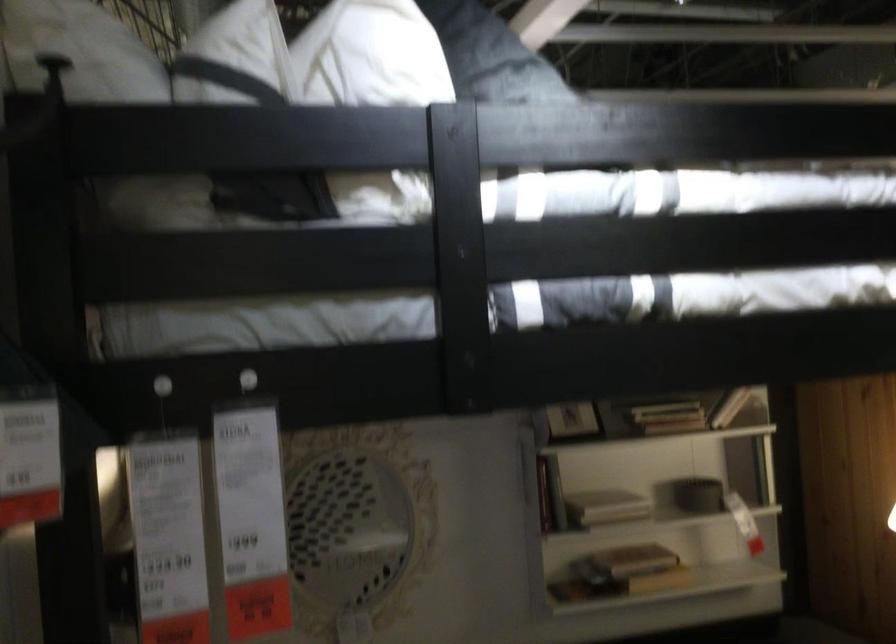
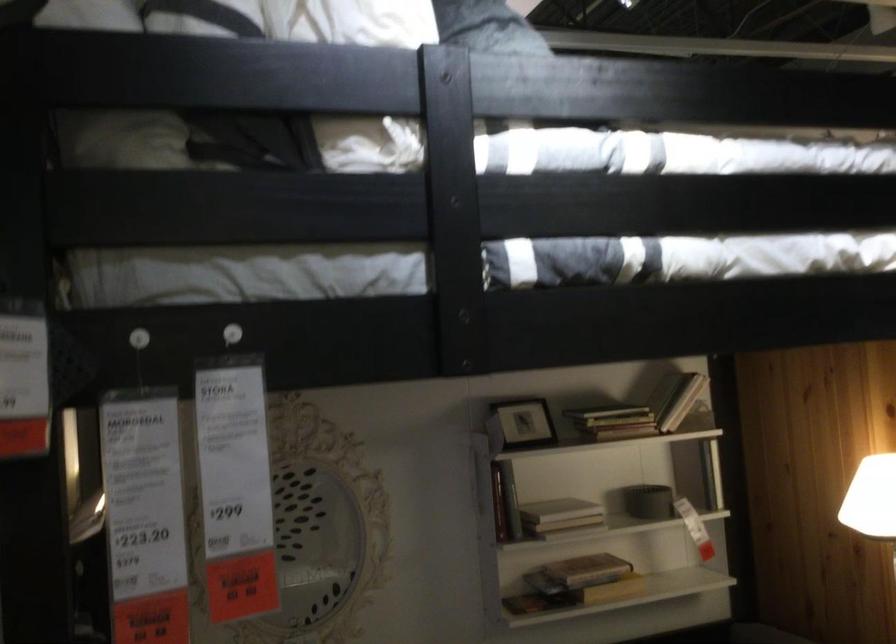
In the second image, find the point that corresponds to (x=458, y=315) in the first image.

(455, 270)